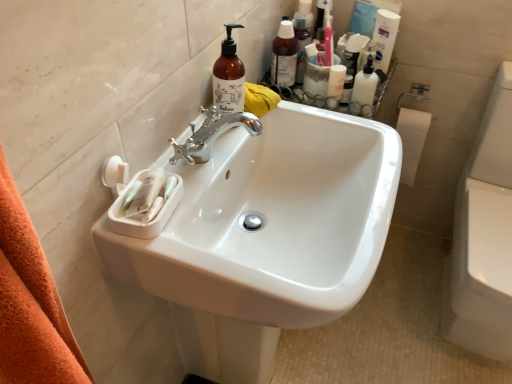
Question: Is point (278, 41) positioned closer to the camera than point (366, 94)?

Choices:
 (A) closer
 (B) farther

Answer: (B)

Question: Is translucent plastic bottles at upper right, the third toiletry viewed from the right, spatially inside white glossy lotion at upper right, acting as the first toiletry starting from the right, or outside of it?

Choices:
 (A) inside
 (B) outside

Answer: (B)

Question: Which object is the closest to the white glossy toilet bowl at right?

Choices:
 (A) white glossy sink at center
 (B) translucent plastic bottles at upper right, which is the 1th toiletry in left-to-right order
 (C) translucent amber bottle at upper center, the 2th cleaning product positioned from the back
 (D) white glossy lotion at upper right, marked as the 3th toiletry in a left-to-right arrangement
 (E) white matte jar at upper right, the 2th toiletry when ordered from right to left

Answer: (D)

Question: Estimate the real-world distances between objects in this image. Which object is closer to the white glossy lotion at upper right, acting as the first toiletry starting from the right?

Choices:
 (A) white glossy toilet bowl at right
 (B) white glossy sink at center
 (C) white matte jar at upper right, the 2th toiletry when ordered from right to left
 (D) translucent amber bottle at upper center, which ranks as the 1th cleaning product in bottom-to-top order
 (E) white glossy lotion at upper right, the 1th cleaning product from the back

Answer: (C)